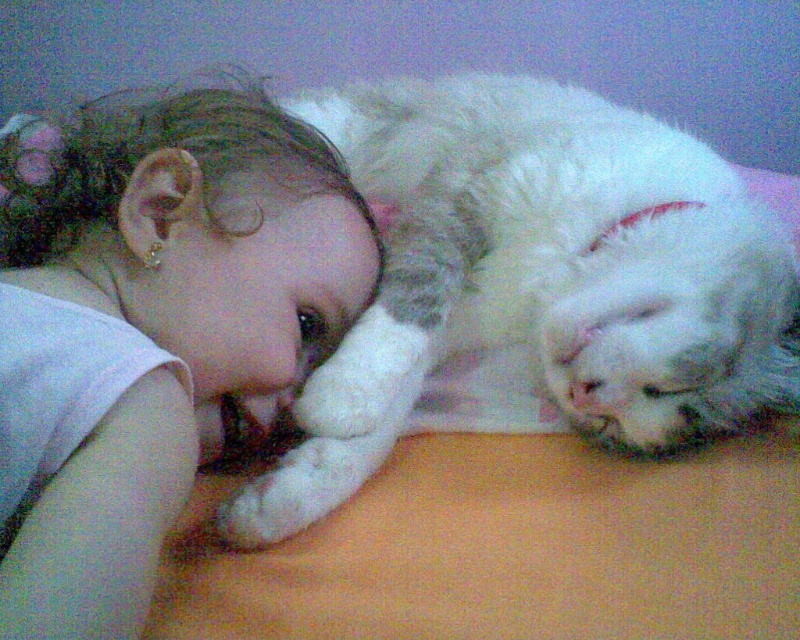
Based on the scene description, can you identify the object located at the coordinates point (152, 328)?

The point (152, 328) indicates smooth skin baby at center.

You are a photographer trying to capture a closeup shot of the smooth skin baby at center and the white fluffy cat at upper right. Since you want both subjects to be in focus, you need to know which one is wider. Which is wider?

The white fluffy cat at upper right is wider than the smooth skin baby at center, so you should adjust your camera settings to focus on the wider subject first.